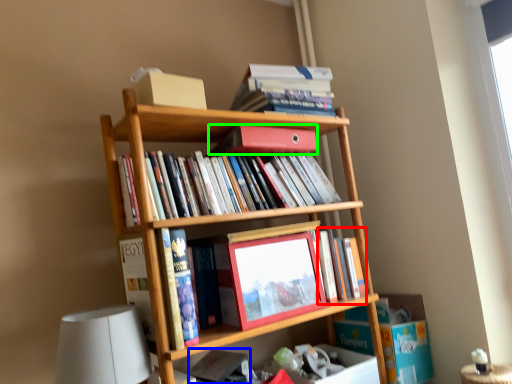
Question: Estimate the real-world distances between objects in this image. Which object is closer to book (highlighted by a red box), book (highlighted by a blue box) or book (highlighted by a green box)?

Choices:
 (A) book
 (B) book

Answer: (B)